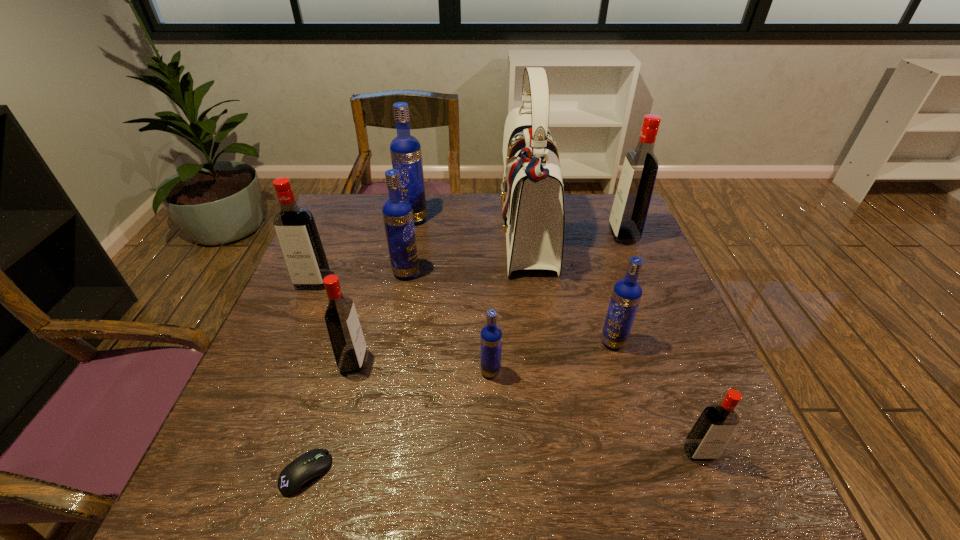
In the image, there is a desktop. Where is `vacant space at the left edge`? The height and width of the screenshot is (540, 960). vacant space at the left edge is located at coordinates (353, 289).

Locate an element on the screen. free space at the right edge of the desktop is located at coordinates (667, 323).

In the image, there is a desktop. Find the location of `vacant space at the far left corner`. vacant space at the far left corner is located at coordinates (363, 224).

Find the location of `free location at the near right corner`. free location at the near right corner is located at coordinates (676, 501).

Where is `empty space that is in between the second farthest blue vodka and the tallest object`? The width and height of the screenshot is (960, 540). empty space that is in between the second farthest blue vodka and the tallest object is located at coordinates (468, 253).

You are a GUI agent. You are given a task and a screenshot of the screen. Output one action in this format:
    pyautogui.click(x=<x>, y=<y>)
    Task: Click on the free space between the tallest object and the second blue vodka from right to left
    This screenshot has height=540, width=960.
    Given the screenshot: What is the action you would take?
    pyautogui.click(x=509, y=303)

You are a GUI agent. You are given a task and a screenshot of the screen. Output one action in this format:
    pyautogui.click(x=<x>, y=<y>)
    Task: Click on the vacant point located between the second farthest red vodka and the tallest object
    The image size is (960, 540).
    Given the screenshot: What is the action you would take?
    pyautogui.click(x=420, y=258)

You are a GUI agent. You are given a task and a screenshot of the screen. Output one action in this format:
    pyautogui.click(x=<x>, y=<y>)
    Task: Click on the vacant space in between the second red vodka from left to right and the nearest blue vodka
    Image resolution: width=960 pixels, height=540 pixels.
    Given the screenshot: What is the action you would take?
    pyautogui.click(x=422, y=367)

Where is `vacant space that is in between the computer equipment and the satchel`? This screenshot has width=960, height=540. vacant space that is in between the computer equipment and the satchel is located at coordinates (417, 354).

Identify the location of free spot between the rightmost blue vodka and the satchel. (570, 288).